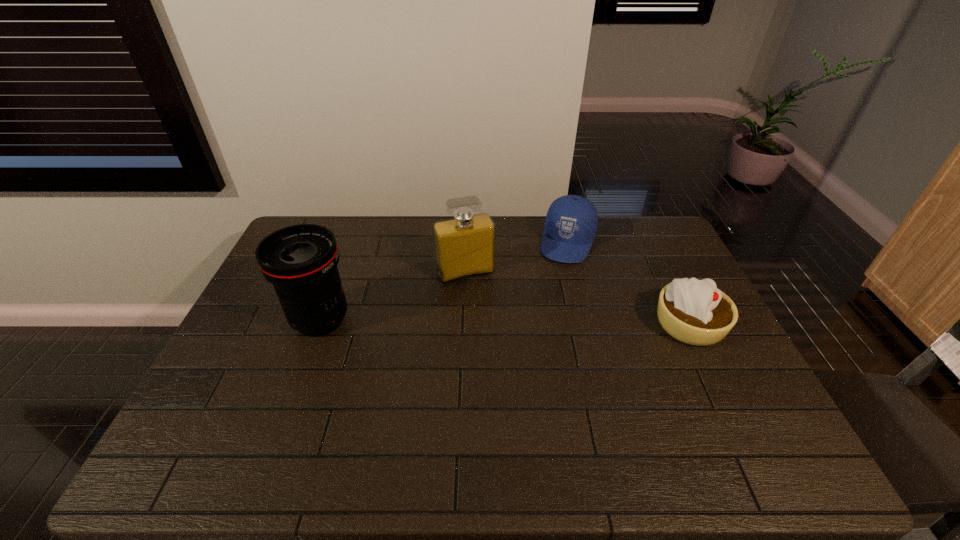
Identify the location of blank space located 0.360m on the front-facing side of the third object from left to right. The width and height of the screenshot is (960, 540). (537, 341).

I want to click on vacant space located on the front-facing side of the third object from left to right, so click(x=546, y=312).

Locate an element on the screen. This screenshot has height=540, width=960. object positioned at the far edge is located at coordinates (571, 222).

This screenshot has width=960, height=540. I want to click on object that is at the left edge, so click(x=300, y=261).

Image resolution: width=960 pixels, height=540 pixels. I want to click on object situated at the right edge, so click(x=695, y=312).

Image resolution: width=960 pixels, height=540 pixels. I want to click on vacant space at the far edge, so click(606, 248).

In the image, there is a desktop. Where is `vacant space at the near edge`? vacant space at the near edge is located at coordinates (408, 397).

Locate an element on the screen. This screenshot has width=960, height=540. vacant space at the left edge of the desktop is located at coordinates (273, 306).

You are a GUI agent. You are given a task and a screenshot of the screen. Output one action in this format:
    pyautogui.click(x=<x>, y=<y>)
    Task: Click on the free space at the right edge
    The height and width of the screenshot is (540, 960).
    Given the screenshot: What is the action you would take?
    pyautogui.click(x=657, y=274)

In order to click on free space at the far right corner of the desktop in this screenshot , I will do `click(666, 232)`.